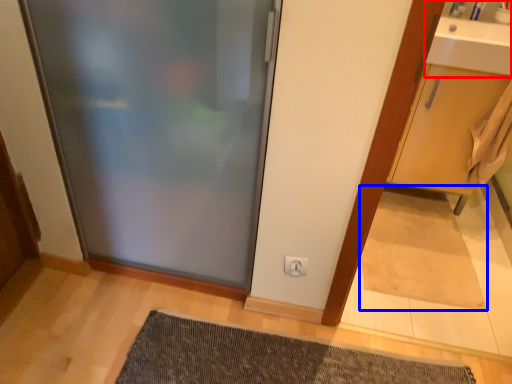
Question: Which of the following is the closest to the observer, sink (highlighted by a red box) or doormat (highlighted by a blue box)?

Choices:
 (A) sink
 (B) doormat

Answer: (A)